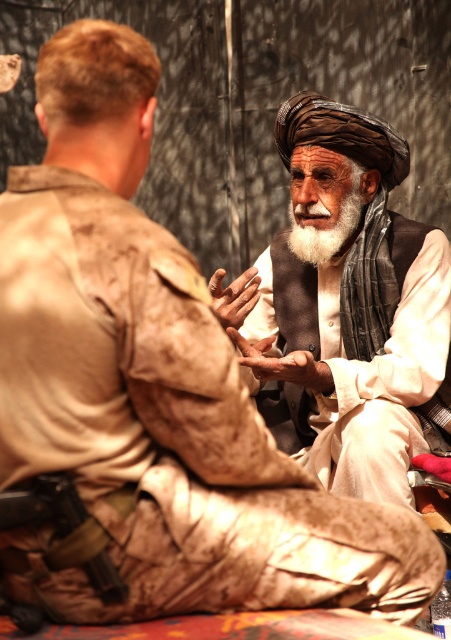
Question: Which point is closer to the camera taking this photo?

Choices:
 (A) (317, 120)
 (B) (313, 362)
 (C) (349, 227)

Answer: (B)

Question: Does brown woven turban at center come behind whitewoollybeard at center?

Choices:
 (A) no
 (B) yes

Answer: (A)

Question: Which object appears closest to the camera in this image?

Choices:
 (A) brown woven turban at center
 (B) whitewoollybeard at center

Answer: (A)

Question: Does camouflage uniform at right appear over brown woven turban at center?

Choices:
 (A) no
 (B) yes

Answer: (A)

Question: Which point is closer to the camera?

Choices:
 (A) (305, 125)
 (B) (294, 243)

Answer: (A)

Question: Can you confirm if brown woven turban at center is bigger than whitewoollybeard at center?

Choices:
 (A) yes
 (B) no

Answer: (A)